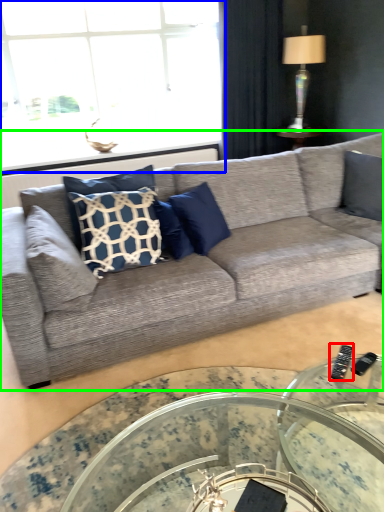
Question: Which is nearer to the remote (highlighted by a red box)? window (highlighted by a blue box) or studio couch (highlighted by a green box).

Choices:
 (A) window
 (B) studio couch

Answer: (B)